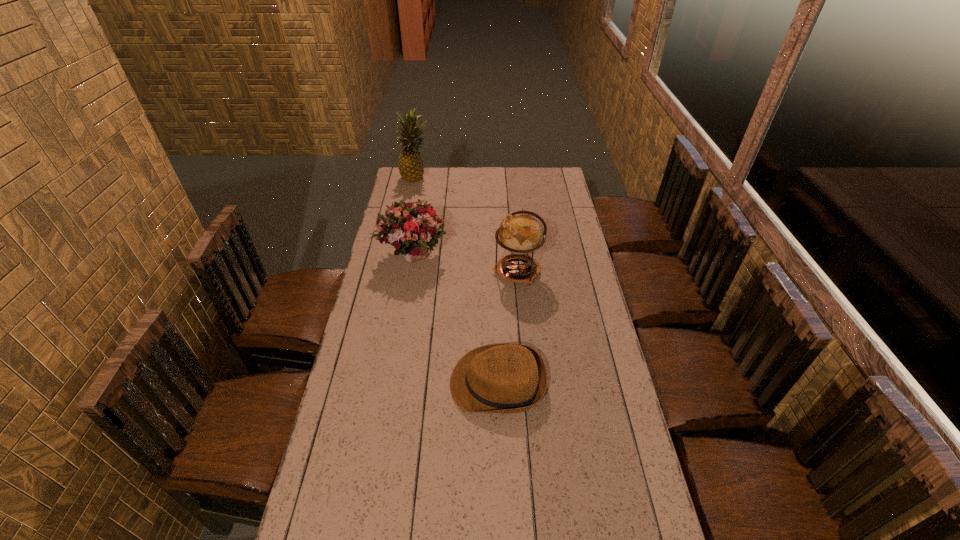
Where is `free space located on the back of the second shortest object`? This screenshot has height=540, width=960. free space located on the back of the second shortest object is located at coordinates (423, 194).

This screenshot has height=540, width=960. Find the location of `vacant space located on the front-facing side of the shortest object`. vacant space located on the front-facing side of the shortest object is located at coordinates (374, 383).

The height and width of the screenshot is (540, 960). In order to click on vacant space situated on the front-facing side of the shortest object in this screenshot , I will do `click(344, 383)`.

The image size is (960, 540). I want to click on blank space located on the front-facing side of the shortest object, so click(x=422, y=383).

Locate an element on the screen. object that is at the far edge is located at coordinates (411, 168).

Where is `pineapple situated at the left edge`? This screenshot has width=960, height=540. pineapple situated at the left edge is located at coordinates (411, 168).

This screenshot has height=540, width=960. In order to click on bouquet positioned at the left edge in this screenshot , I will do `click(412, 228)`.

Where is `object positioned at the far left corner`? The width and height of the screenshot is (960, 540). object positioned at the far left corner is located at coordinates (411, 168).

Identify the location of free point at the far edge. The height and width of the screenshot is (540, 960). (527, 181).

This screenshot has height=540, width=960. Find the location of `free region at the left edge`. free region at the left edge is located at coordinates (374, 313).